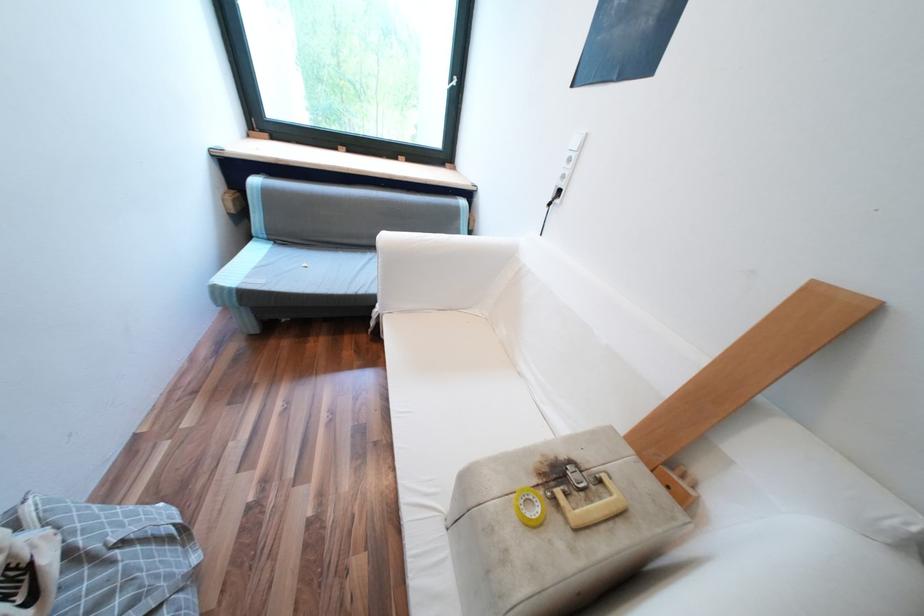
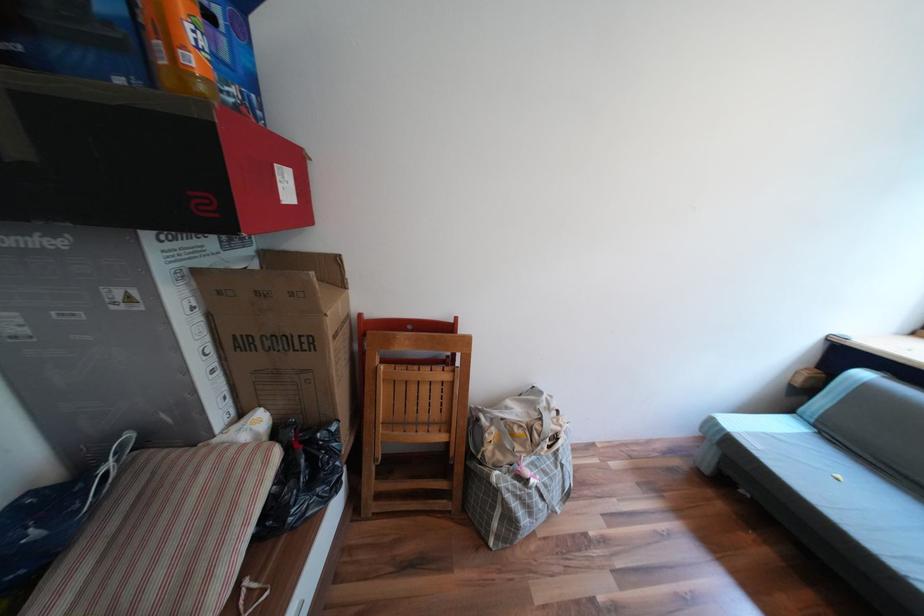
Question: The camera is either moving clockwise (left) or counter-clockwise (right) around the object. The first image is from the beginning of the video and the second image is from the end. Is the camera moving left or right when shooting the video?

Choices:
 (A) Left
 (B) Right

Answer: (B)